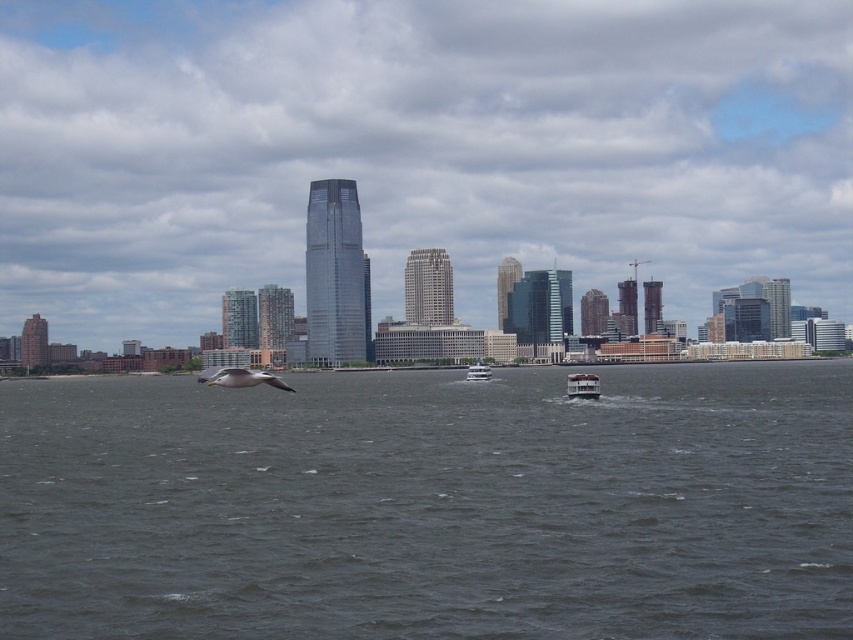
You are a photographer trying to capture the city skyline. You notice the transparent glass skyscraper at center and the white glossy ferry at center in your viewfinder. Which object should you focus on if you want to emphasize the scale of the city compared to the watercraft?

The transparent glass skyscraper at center is larger than the white glossy ferry at center, so focusing on it would better emphasize the scale of the city compared to the watercraft.

You are a photographer trying to capture both the white glossy ferry at center and the white glossy boat at center in a single frame. Given their widths, which one will occupy more space in your photo?

The white glossy ferry at center has a greater width than the white glossy boat at center, so it will occupy more space in the photo.

You are a drone operator tasked with delivering a package to the tallest building in the city. Your drone is currently hovering at point coordinates point (416, 148). Can you confirm if this point is directly above the transparent glass skyscraper at center?

Yes, the point (416, 148) is directly above the transparent glass skyscraper at center as stated in the objects description.